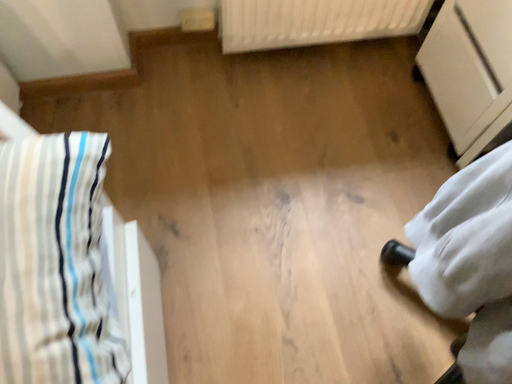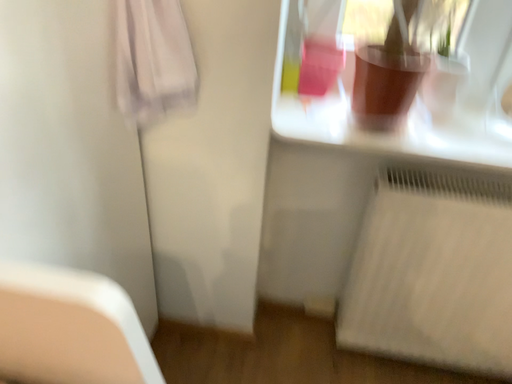
Question: How did the camera likely rotate when shooting the video?

Choices:
 (A) rotated downward
 (B) rotated upward

Answer: (B)